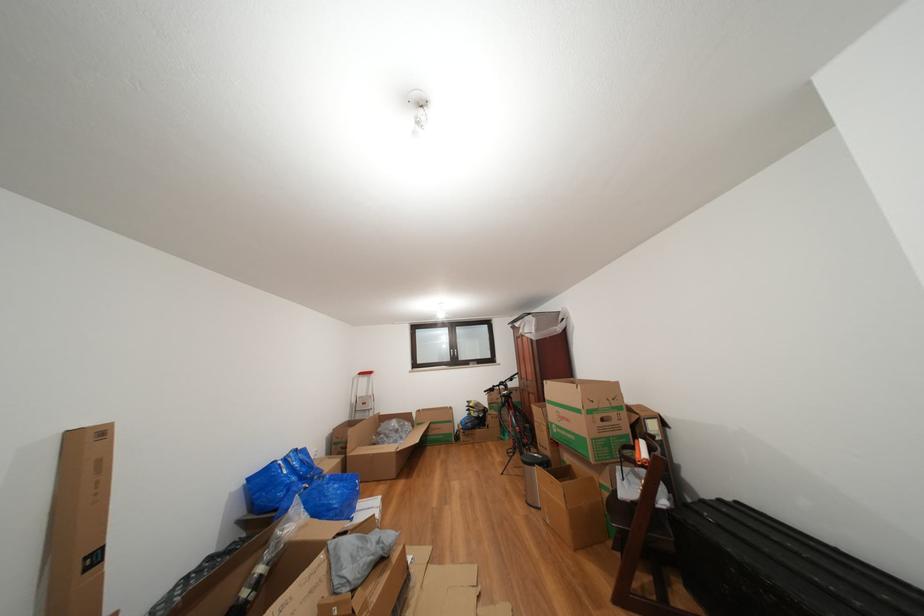
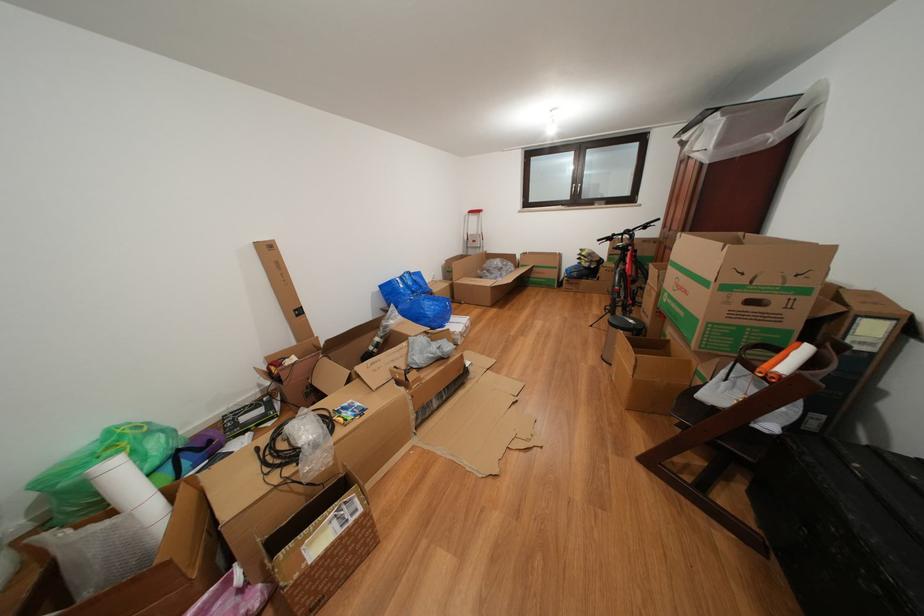
Locate, in the second image, the point that corresponds to the point at 666,512 in the first image.

(763, 431)